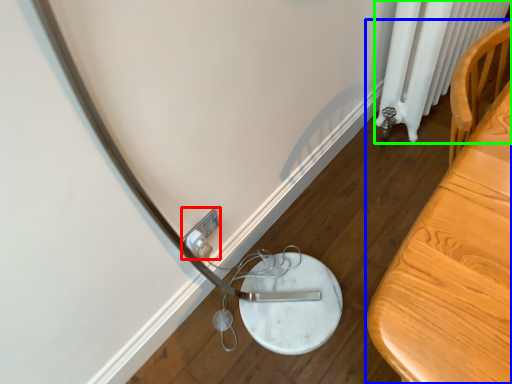
Question: Which object is positioned closest to electric outlet (highlighted by a red box)? Select from furniture (highlighted by a blue box) and radiator (highlighted by a green box).

Choices:
 (A) furniture
 (B) radiator

Answer: (A)